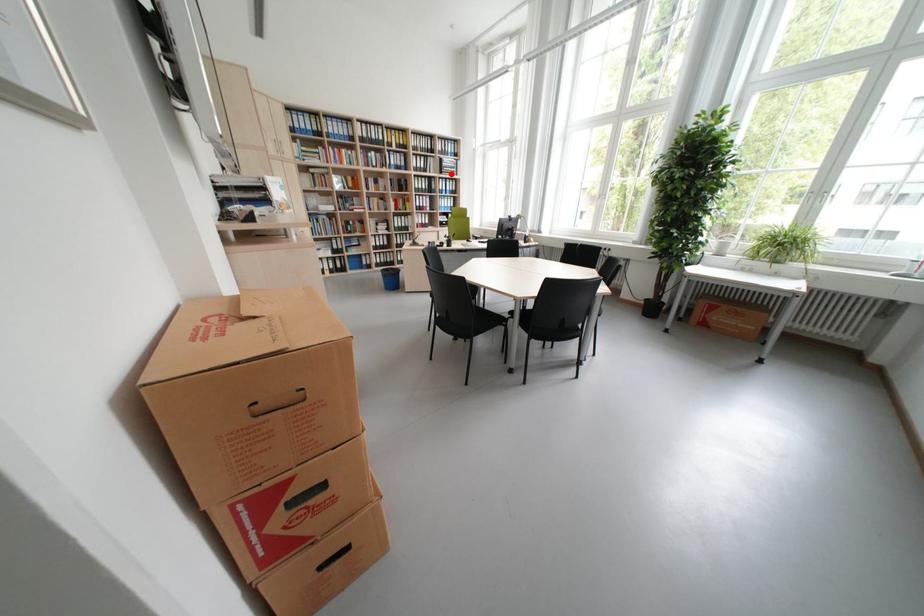
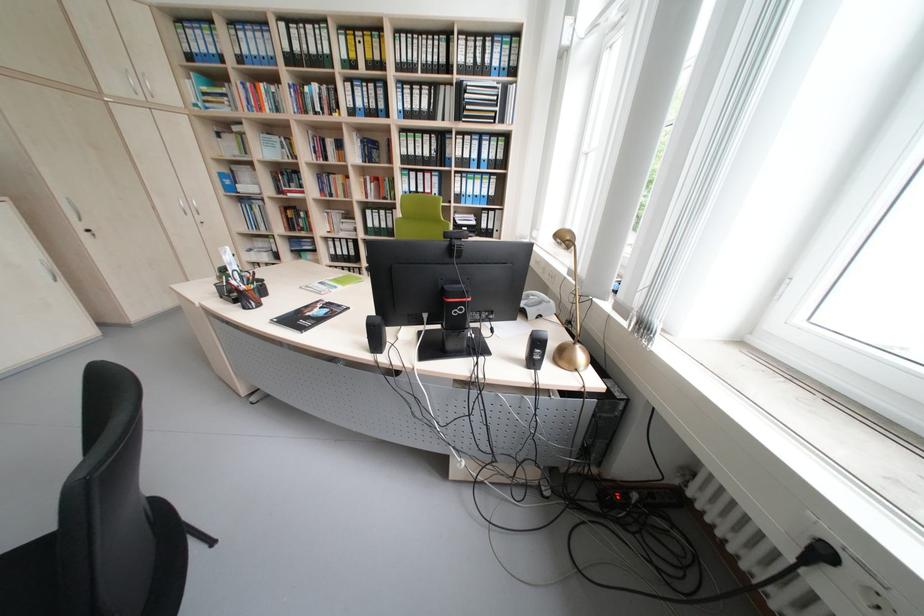
In the second image, find the point that corresponds to the highlighted location in the first image.

(468, 119)